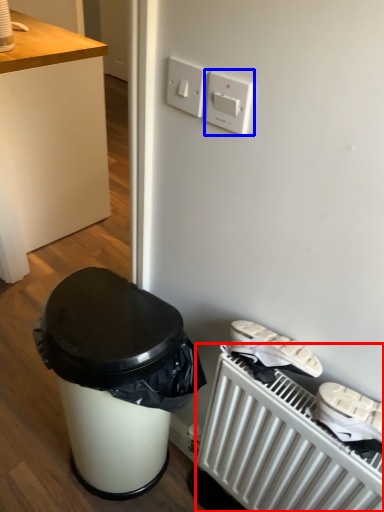
Question: Which object appears farthest to the camera in this image, radiator (highlighted by a red box) or light switch (highlighted by a blue box)?

Choices:
 (A) radiator
 (B) light switch

Answer: (A)